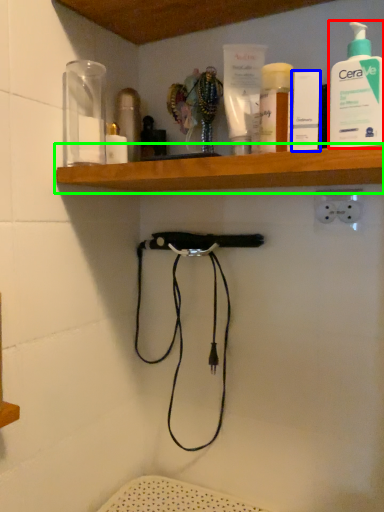
Question: Which object is positioned farthest from cleaning product (highlighted by a red box)? Select from toiletry (highlighted by a blue box) and shelf (highlighted by a green box).

Choices:
 (A) toiletry
 (B) shelf

Answer: (B)